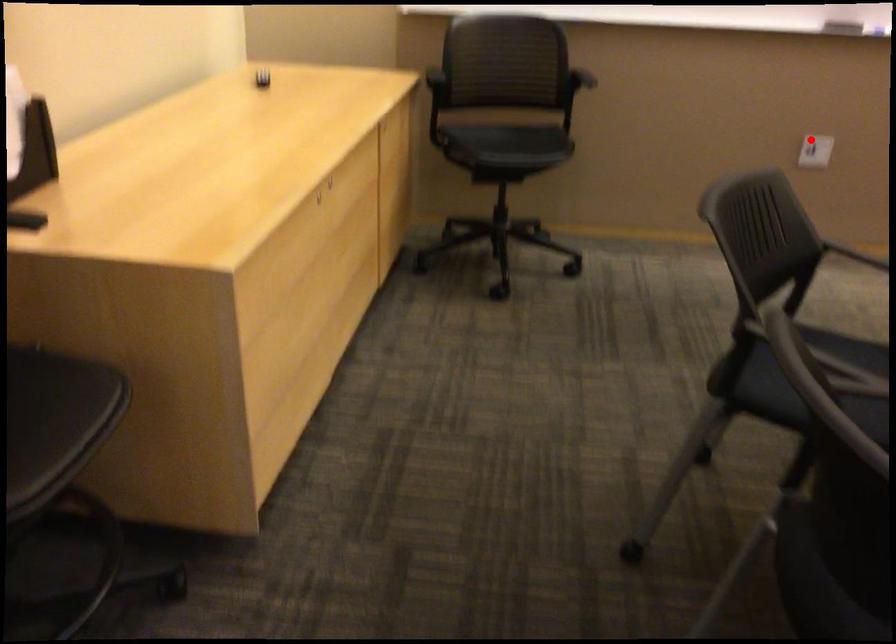
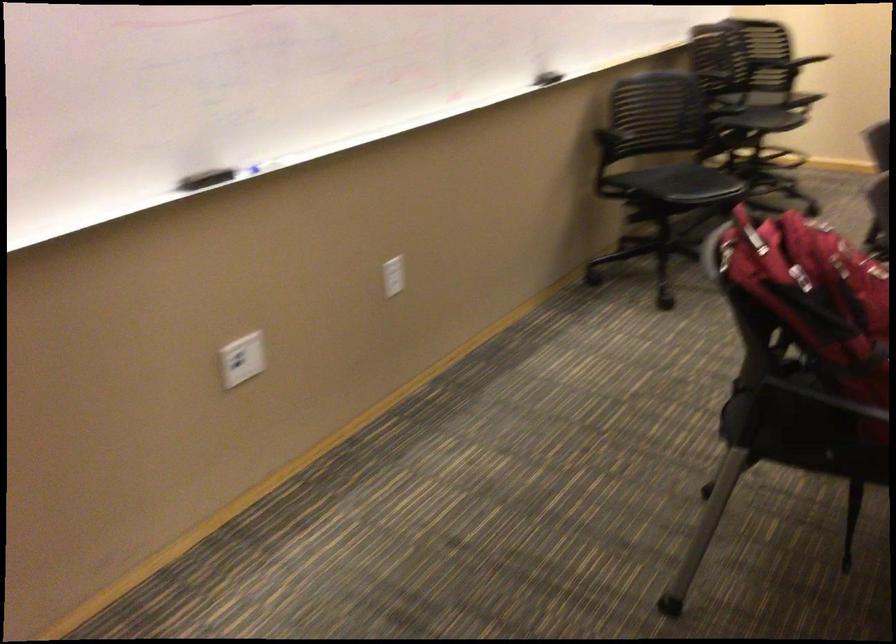
In the second image, find the point that corresponds to the highlighted location in the first image.

(242, 359)